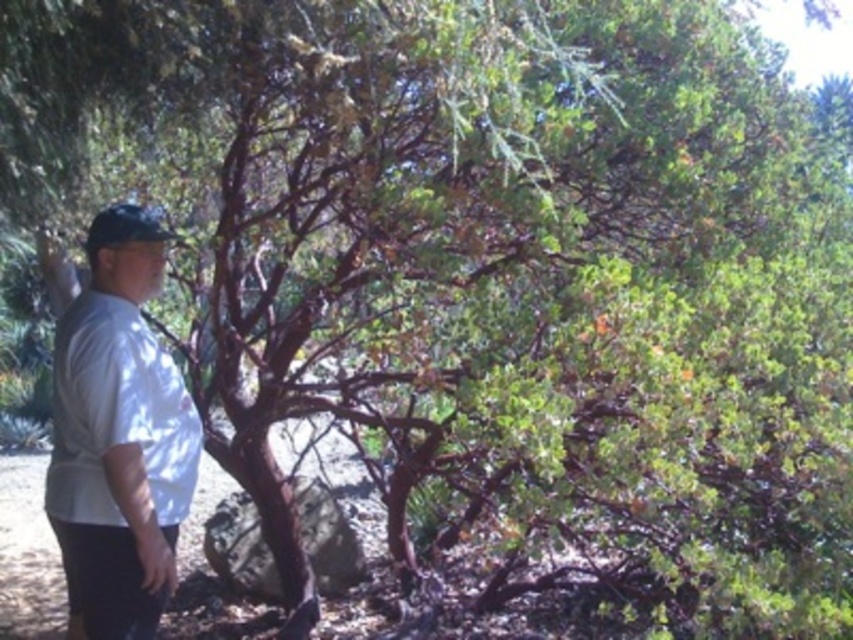
Which is above, white cotton shirt at left or white matte shirt at left?

white matte shirt at left

Find the location of a particular element. white cotton shirt at left is located at coordinates (119, 436).

Is point (155, 260) positioned before point (59, 445)?

That is False.

The image size is (853, 640). Find the location of `white cotton shirt at left`. white cotton shirt at left is located at coordinates (119, 436).

Is white cotton shirt at left in front of black matte baseball hat at left?

That is True.

Describe the element at coordinates (119, 436) in the screenshot. I see `white cotton shirt at left` at that location.

Between point (86, 568) and point (108, 234), which one is positioned behind?

The point (108, 234) is behind.

Find the location of a particular element. The height and width of the screenshot is (640, 853). white cotton shirt at left is located at coordinates (119, 436).

Is point (100, 323) farther from viewer compared to point (91, 250)?

No, (100, 323) is closer to viewer.

Is white matte shirt at left thinner than black matte baseball hat at left?

In fact, white matte shirt at left might be wider than black matte baseball hat at left.

Looking at this image, who is more distant from viewer, (45, 509) or (132, 208)?

→ Positioned behind is point (132, 208).

Image resolution: width=853 pixels, height=640 pixels. What are the coordinates of `white matte shirt at left` in the screenshot? It's located at (115, 413).